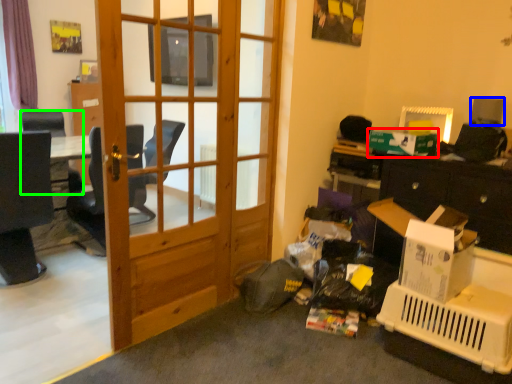
Question: Which is farther away from box (highlighted by a red box)? loudspeaker (highlighted by a blue box) or chair (highlighted by a green box)?

Choices:
 (A) loudspeaker
 (B) chair

Answer: (B)